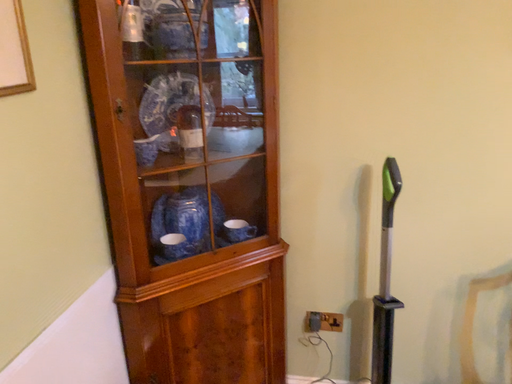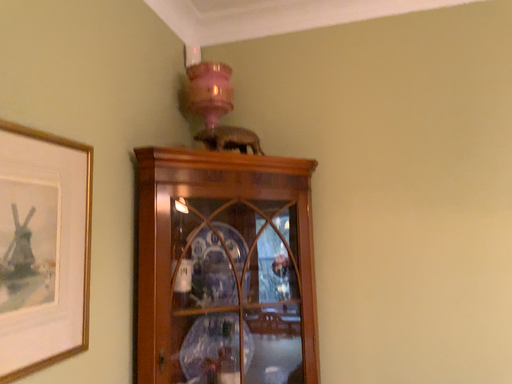
Question: Which way did the camera rotate in the video?

Choices:
 (A) rotated downward
 (B) rotated upward

Answer: (B)